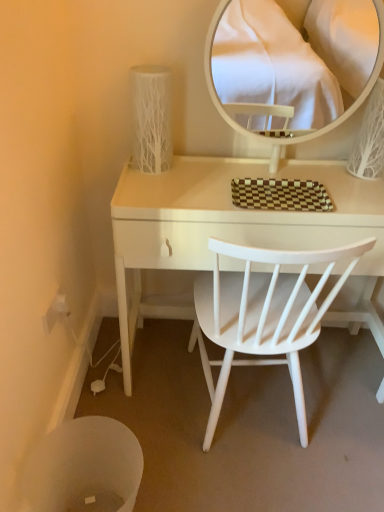
Question: From a real-world perspective, is white plastic trash bin at lower left above or below white wood desk at center?

Choices:
 (A) below
 (B) above

Answer: (A)

Question: Looking at the image, does white plastic trash bin at lower left seem bigger or smaller compared to white wood desk at center?

Choices:
 (A) small
 (B) big

Answer: (A)

Question: Which is nearer to the brown checkered tray at center?

Choices:
 (A) white wood desk at center
 (B) white textured vase at upper left
 (C) white plastic power outlet at lower left
 (D) white plastic trash bin at lower left
 (E) white wood chair at center

Answer: (A)

Question: Estimate the real-world distances between objects in this image. Which object is farther from the white plastic trash bin at lower left?

Choices:
 (A) white textured vase at upper left
 (B) white plastic power outlet at lower left
 (C) white glossy mirror at upper center
 (D) white wood desk at center
 (E) white wood chair at center

Answer: (C)